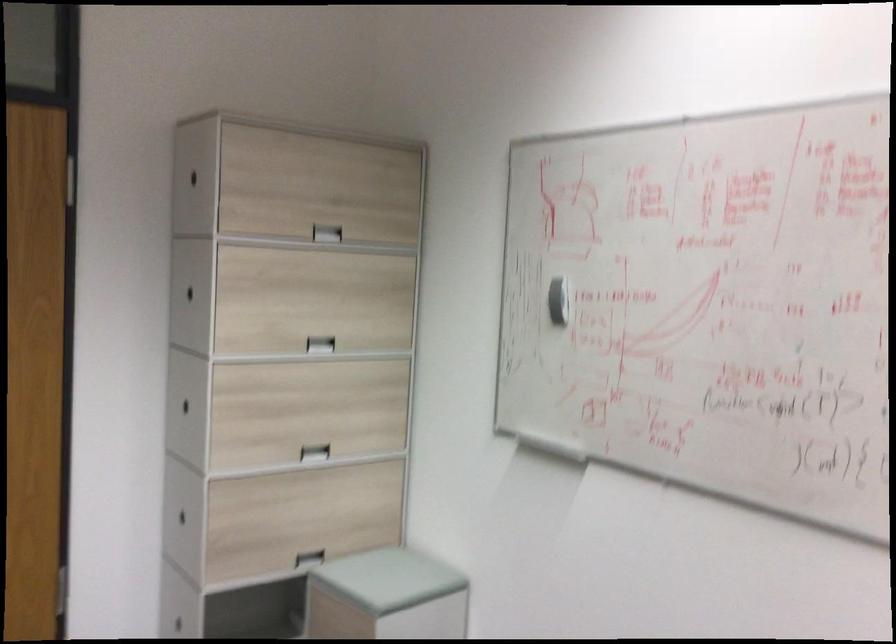
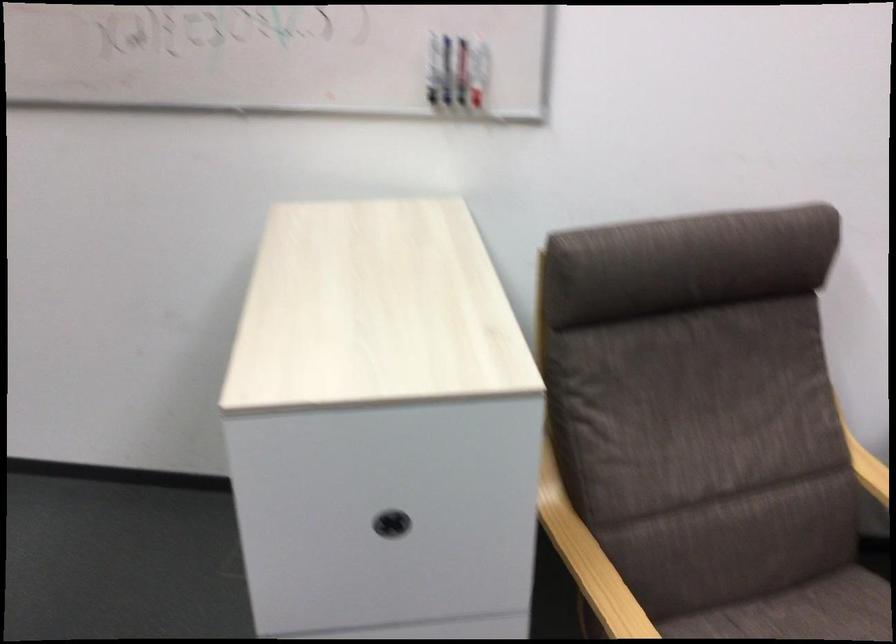
First-person continuous shooting, in which direction is the camera rotating?

The rotation direction of the camera is right-down.